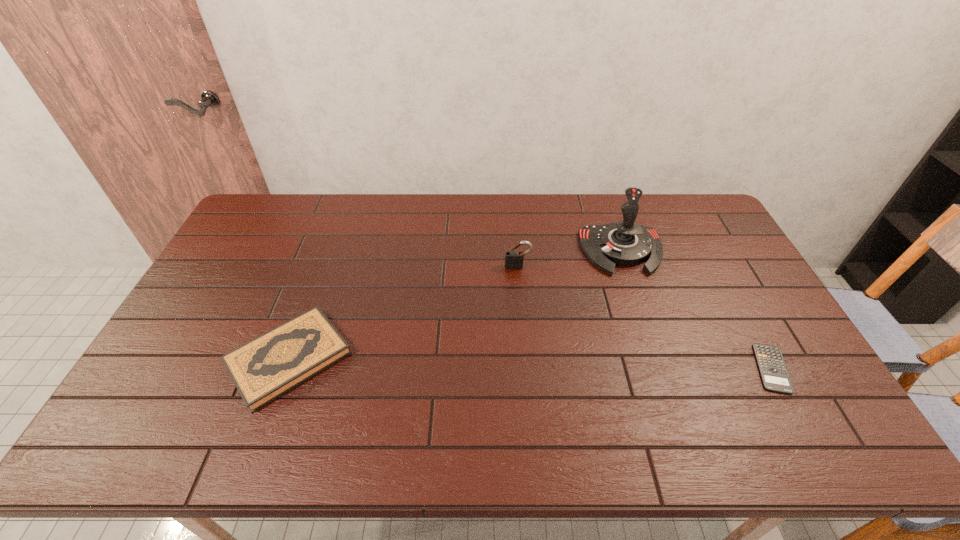
Identify the location of empty location between the rightmost object and the third tallest object. The height and width of the screenshot is (540, 960). (530, 363).

Identify the location of free point between the calculator and the third object from right to left. (645, 318).

Image resolution: width=960 pixels, height=540 pixels. What are the coordinates of `free point between the padlock and the hardback book` in the screenshot? It's located at (x=403, y=312).

Identify the location of free space between the hardback book and the second object from left to right. (403, 312).

Image resolution: width=960 pixels, height=540 pixels. What are the coordinates of `unoccupied position between the leftmost object and the padlock` in the screenshot? It's located at (403, 312).

In order to click on free area in between the leftmost object and the rightmost object in this screenshot , I will do `click(530, 363)`.

At what (x,y) coordinates should I click in order to perform the action: click on vacant area between the tallest object and the third tallest object. Please return your answer as a coordinate pair (x, y). Looking at the image, I should click on (455, 305).

You are a GUI agent. You are given a task and a screenshot of the screen. Output one action in this format:
    pyautogui.click(x=<x>, y=<y>)
    Task: Click on the free area in between the joystick and the second tallest object
    
    Given the screenshot: What is the action you would take?
    pyautogui.click(x=569, y=259)

Find the location of `vacant space in between the joystick and the third tallest object`. vacant space in between the joystick and the third tallest object is located at coordinates (455, 305).

Identify the location of the third closest object to the joystick. (263, 369).